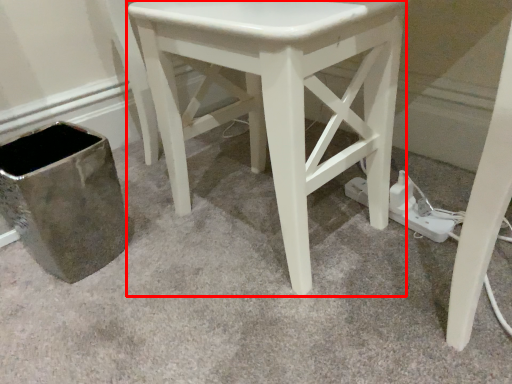
Question: Considering the relative positions of stool (annotated by the red box) and plug in the image provided, where is stool (annotated by the red box) located with respect to the staircase?

Choices:
 (A) left
 (B) right

Answer: (A)